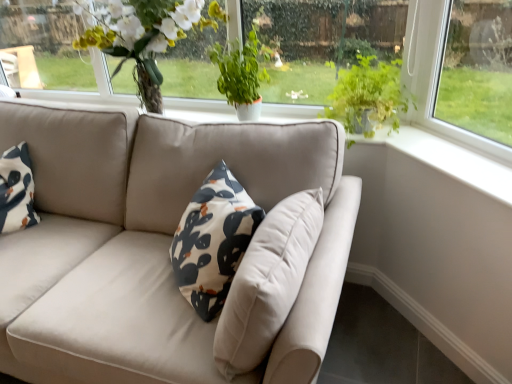
Question: From a real-world perspective, is matte white vase at upper center positioned over green leafy plant at upper right, marked as the first houseplant in a right-to-left arrangement, based on gravity?

Choices:
 (A) no
 (B) yes

Answer: (B)

Question: Is green leafy plant at upper right, which appears as the second houseplant when viewed from the left, inside matte white vase at upper center?

Choices:
 (A) no
 (B) yes

Answer: (A)

Question: Considering the relative positions of matte white vase at upper center and green leafy plant at upper right, marked as the first houseplant in a right-to-left arrangement, in the image provided, is matte white vase at upper center in front of green leafy plant at upper right, marked as the first houseplant in a right-to-left arrangement,?

Choices:
 (A) yes
 (B) no

Answer: (B)

Question: Can you confirm if matte white vase at upper center is shorter than green leafy plant at upper right, which appears as the second houseplant when viewed from the left?

Choices:
 (A) yes
 (B) no

Answer: (B)

Question: Can we say matte white vase at upper center lies outside green leafy plant at upper right, which appears as the second houseplant when viewed from the left?

Choices:
 (A) no
 (B) yes

Answer: (B)

Question: Are matte white vase at upper center and green leafy plant at upper right, which appears as the second houseplant when viewed from the left, making contact?

Choices:
 (A) yes
 (B) no

Answer: (B)

Question: Considering the relative sizes of matte white vase at upper center and green leafy plant at center, arranged as the 1th houseplant when viewed from the left, in the image provided, is matte white vase at upper center shorter than green leafy plant at center, arranged as the 1th houseplant when viewed from the left,?

Choices:
 (A) yes
 (B) no

Answer: (B)

Question: Can you confirm if matte white vase at upper center is taller than green leafy plant at center, placed as the 2th houseplant when sorted from right to left?

Choices:
 (A) no
 (B) yes

Answer: (B)

Question: Is matte white vase at upper center facing away from green leafy plant at center, placed as the 2th houseplant when sorted from right to left?

Choices:
 (A) yes
 (B) no

Answer: (B)

Question: Is the position of matte white vase at upper center less distant than that of green leafy plant at center, placed as the 2th houseplant when sorted from right to left?

Choices:
 (A) no
 (B) yes

Answer: (B)

Question: Does matte white vase at upper center turn towards green leafy plant at center, arranged as the 1th houseplant when viewed from the left?

Choices:
 (A) yes
 (B) no

Answer: (B)

Question: Considering the relative sizes of matte white vase at upper center and green leafy plant at center, placed as the 2th houseplant when sorted from right to left, in the image provided, is matte white vase at upper center thinner than green leafy plant at center, placed as the 2th houseplant when sorted from right to left,?

Choices:
 (A) yes
 (B) no

Answer: (B)

Question: Would you say green leafy plant at upper center is a long distance from green leafy plant at center, placed as the 2th houseplant when sorted from right to left?

Choices:
 (A) no
 (B) yes

Answer: (A)